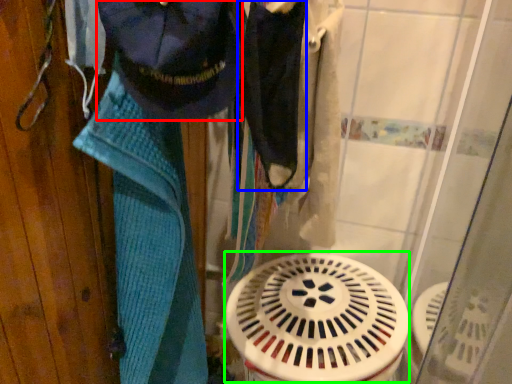
Question: Based on their relative distances, which object is farther from clothing (highlighted by a red box)? Choose from clothing (highlighted by a blue box) and water heater (highlighted by a green box).

Choices:
 (A) clothing
 (B) water heater

Answer: (B)